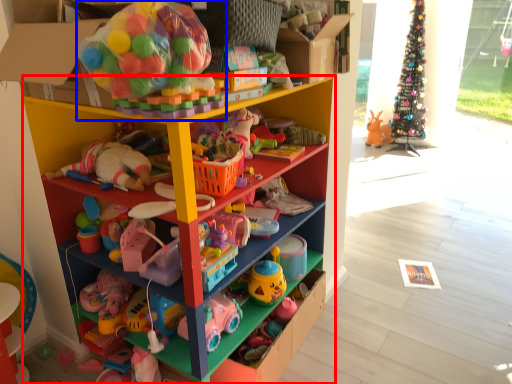
Question: Which point is closer to the camera, shelf (highlighted by a red box) or toy (highlighted by a blue box)?

Choices:
 (A) shelf
 (B) toy

Answer: (B)